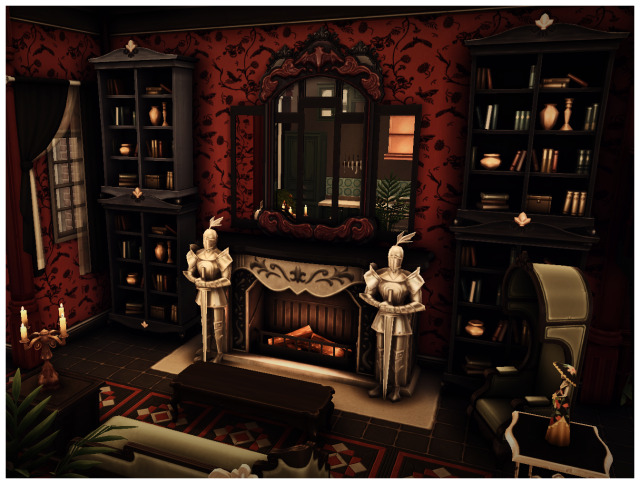
Where is `rug`? Image resolution: width=640 pixels, height=484 pixels. rug is located at coordinates (166, 414).